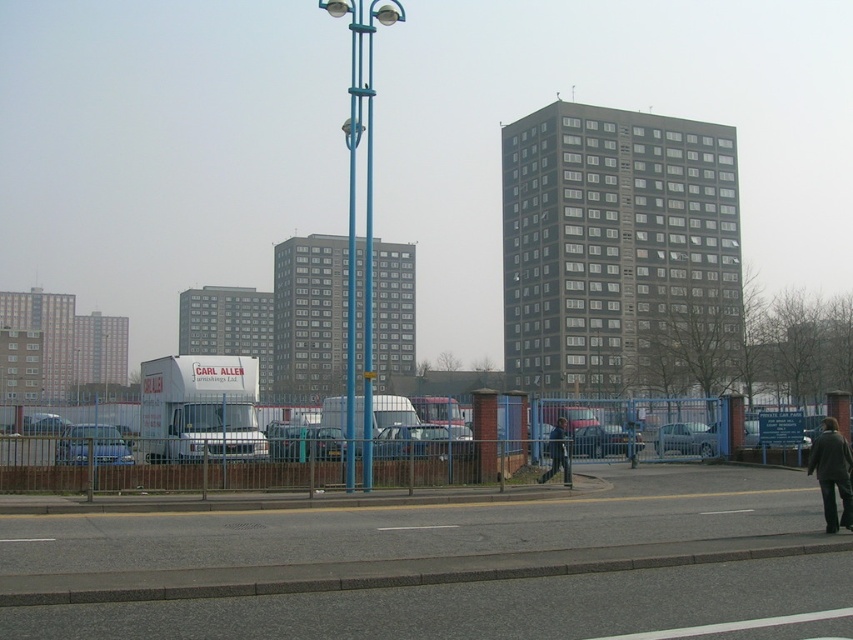
You are a delivery person who needs to place a large package on the sidewalk between the dark gray coat at lower right and the dark gray jacket at center. Which item should you place the package next to to ensure it fits?

The dark gray coat at lower right has a larger width than the dark gray jacket at center, so placing the package next to the dark gray coat at lower right would provide more space for the package to fit.

You are a delivery person who needs to place a package between the dark gray coat at lower right and the dark gray jacket at center. Can you place it directly in between them?

The dark gray coat at lower right is in front of the dark gray jacket at center, so there is no space between them for the package. You need to place it either in front of the dark gray coat at lower right or behind the dark gray jacket at center.